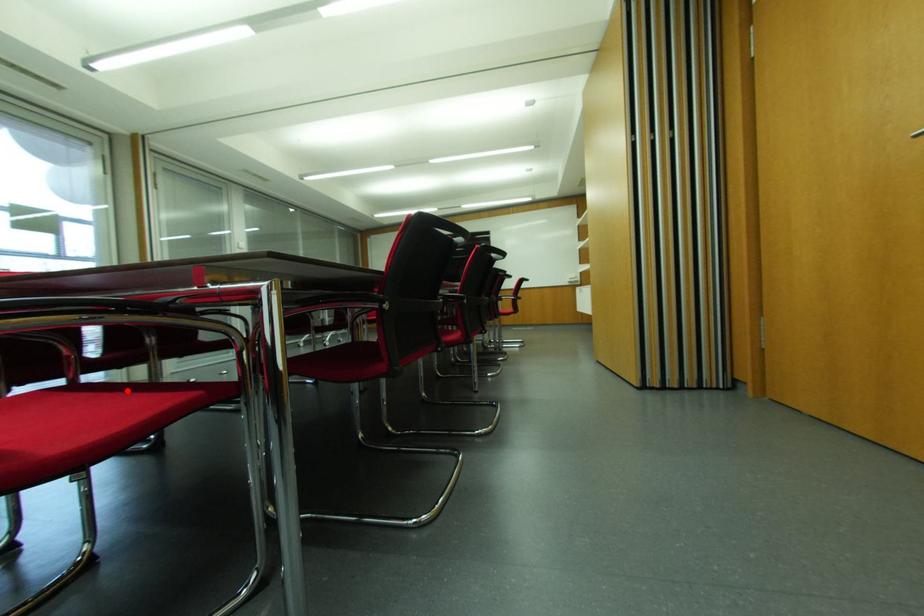
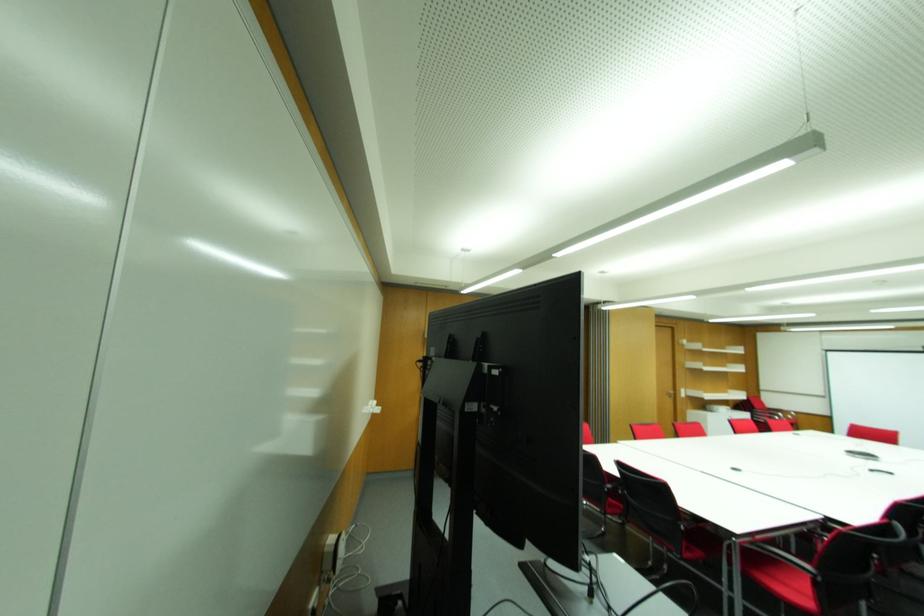
Question: I am providing you with two images of the same scene from different viewpoints. A red point is marked on the first image. At the location where the point appears in image 1, is it still visible in image 2?

Choices:
 (A) Yes
 (B) No

Answer: (B)